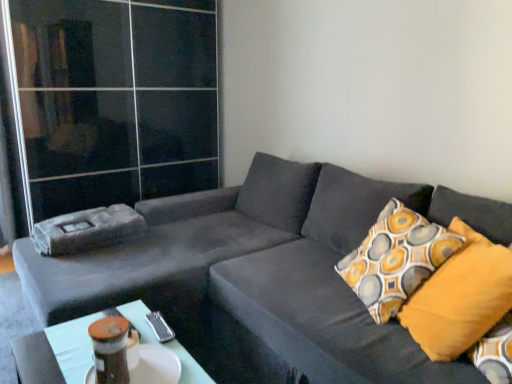
At what (x,y) coordinates should I click in order to perform the action: click on mustard yellow fabric pillow at right. Please return your answer as a coordinate pair (x, y). The width and height of the screenshot is (512, 384). Looking at the image, I should click on (460, 297).

The width and height of the screenshot is (512, 384). Identify the location of transparent glass door at upper left. point(112,100).

The height and width of the screenshot is (384, 512). What do you see at coordinates (112, 100) in the screenshot?
I see `transparent glass door at upper left` at bounding box center [112, 100].

Identify the location of mustard yellow fabric pillow at right. (460, 297).

Between velvet gray couch at center and transparent glass door at upper left, which one has more height?

Standing taller between the two is transparent glass door at upper left.

From a real-world perspective, which is physically below, velvet gray couch at center or transparent glass door at upper left?

From a 3D spatial view, velvet gray couch at center is below.

Looking at their sizes, would you say velvet gray couch at center is wider or thinner than transparent glass door at upper left?

In the image, velvet gray couch at center appears to be wider than transparent glass door at upper left.

From the image's perspective, which is above, velvet gray couch at center or transparent glass door at upper left?

transparent glass door at upper left.

Is matte plastic table at lower center at the right side of mustard yellow fabric pillow at right?

Incorrect, matte plastic table at lower center is not on the right side of mustard yellow fabric pillow at right.

How different are the orientations of matte plastic table at lower center and mustard yellow fabric pillow at right in degrees?

There is a 22.8-degree angle between the facing directions of matte plastic table at lower center and mustard yellow fabric pillow at right.

Considering the relative sizes of matte plastic table at lower center and mustard yellow fabric pillow at right in the image provided, is matte plastic table at lower center wider than mustard yellow fabric pillow at right?

No, matte plastic table at lower center is not wider than mustard yellow fabric pillow at right.

Is matte plastic table at lower center located outside mustard yellow fabric pillow at right?

Indeed, matte plastic table at lower center is completely outside mustard yellow fabric pillow at right.

Locate an element on the screen. glass door above the mustard yellow fabric pillow at right (from a real-world perspective) is located at coordinates (112, 100).

Would you consider mustard yellow fabric pillow at right to be distant from transparent glass door at upper left?

That's right, there is a large distance between mustard yellow fabric pillow at right and transparent glass door at upper left.

Does mustard yellow fabric pillow at right turn towards transparent glass door at upper left?

No, mustard yellow fabric pillow at right is not aimed at transparent glass door at upper left.

Which object is wider, mustard yellow fabric pillow at right or transparent glass door at upper left?

With larger width is transparent glass door at upper left.

Is matte plastic table at lower center positioned behind transparent glass door at upper left?

No, matte plastic table at lower center is closer to the viewer.

Can transparent glass door at upper left be found inside matte plastic table at lower center?

No, transparent glass door at upper left is not a part of matte plastic table at lower center.

Is matte plastic table at lower center smaller than transparent glass door at upper left?

Indeed, matte plastic table at lower center has a smaller size compared to transparent glass door at upper left.

How distant is matte plastic table at lower center from transparent glass door at upper left?

They are 6.28 feet apart.

From the image's perspective, is transparent glass door at upper left located above mustard yellow fabric pillow at right?

Yes, from the image's perspective, transparent glass door at upper left is on top of mustard yellow fabric pillow at right.

Where is `glass door above the mustard yellow fabric pillow at right (from a real-world perspective)`? Image resolution: width=512 pixels, height=384 pixels. glass door above the mustard yellow fabric pillow at right (from a real-world perspective) is located at coordinates (x=112, y=100).

From a real-world perspective, does transparent glass door at upper left stand above mustard yellow fabric pillow at right?

Yes, from a real-world perspective, transparent glass door at upper left is over mustard yellow fabric pillow at right

Is transparent glass door at upper left taller or shorter than mustard yellow fabric pillow at right?

Answer: In the image, transparent glass door at upper left appears to be taller than mustard yellow fabric pillow at right.

Is the depth of matte plastic table at lower center less than that of velvet gray couch at center?

No, it is behind velvet gray couch at center.

Is matte plastic table at lower center taller than velvet gray couch at center?

Incorrect, the height of matte plastic table at lower center is not larger of that of velvet gray couch at center.

From a real-world perspective, is matte plastic table at lower center positioned over velvet gray couch at center based on gravity?

No, from a real-world perspective, matte plastic table at lower center is not on top of velvet gray couch at center.

Is point (187, 383) positioned after point (477, 203)?

No, (187, 383) is in front of (477, 203).

From the picture: Considering the relative positions of mustard yellow fabric pillow at right and velvet gray couch at center in the image provided, is mustard yellow fabric pillow at right to the right of velvet gray couch at center from the viewer's perspective?

Yes.

Which is more distant, (x=446, y=267) or (x=22, y=283)?

The point (x=22, y=283) is more distant.

Is mustard yellow fabric pillow at right spatially inside velvet gray couch at center, or outside of it?

mustard yellow fabric pillow at right is spatially positioned inside velvet gray couch at center.

Based on the photo, from a real-world perspective, is mustard yellow fabric pillow at right on top of velvet gray couch at center?

Yes, from a real-world perspective, mustard yellow fabric pillow at right is above velvet gray couch at center.

I want to click on studio couch lying in front of the transparent glass door at upper left, so click(x=264, y=275).

Find the location of a particular element. This screenshot has width=512, height=384. pillow that is above the matte plastic table at lower center (from a real-world perspective) is located at coordinates (460, 297).

Looking at the image, which one is located closer to matte plastic table at lower center, mustard yellow fabric pillow at right or transparent glass door at upper left?

mustard yellow fabric pillow at right lies closer to matte plastic table at lower center than the other object.

Looking at the image, which one is located further to velvet gray couch at center, mustard yellow fabric pillow at right or matte plastic table at lower center?

Based on the image, matte plastic table at lower center appears to be further to velvet gray couch at center.

Considering their positions, is matte plastic table at lower center positioned closer to velvet gray couch at center than mustard yellow fabric pillow at right?

mustard yellow fabric pillow at right is positioned closer to the anchor velvet gray couch at center.

Estimate the real-world distances between objects in this image. Which object is closer to transparent glass door at upper left, velvet gray couch at center or matte plastic table at lower center?

velvet gray couch at center is positioned closer to the anchor transparent glass door at upper left.

Estimate the real-world distances between objects in this image. Which object is closer to velvet gray couch at center, mustard yellow fabric pillow at right or transparent glass door at upper left?

Based on the image, mustard yellow fabric pillow at right appears to be nearer to velvet gray couch at center.

Which object lies nearer to the anchor point matte plastic table at lower center, velvet gray couch at center or mustard yellow fabric pillow at right?

velvet gray couch at center is closer to matte plastic table at lower center.

Estimate the real-world distances between objects in this image. Which object is closer to transparent glass door at upper left, velvet gray couch at center or mustard yellow fabric pillow at right?

velvet gray couch at center is closer to transparent glass door at upper left.

From the image, which object appears to be farther from mustard yellow fabric pillow at right, matte plastic table at lower center or transparent glass door at upper left?

Based on the image, transparent glass door at upper left appears to be further to mustard yellow fabric pillow at right.

What are the coordinates of `studio couch located between matte plastic table at lower center and mustard yellow fabric pillow at right in the left-right direction` in the screenshot? It's located at (264, 275).

The width and height of the screenshot is (512, 384). What are the coordinates of `table located between transparent glass door at upper left and mustard yellow fabric pillow at right in the left-right direction` in the screenshot? It's located at (73, 347).

The width and height of the screenshot is (512, 384). In order to click on table located between velvet gray couch at center and transparent glass door at upper left in the depth direction in this screenshot , I will do `click(73, 347)`.

At what (x,y) coordinates should I click in order to perform the action: click on pillow between velvet gray couch at center and transparent glass door at upper left along the z-axis. Please return your answer as a coordinate pair (x, y). Image resolution: width=512 pixels, height=384 pixels. Looking at the image, I should click on (460, 297).